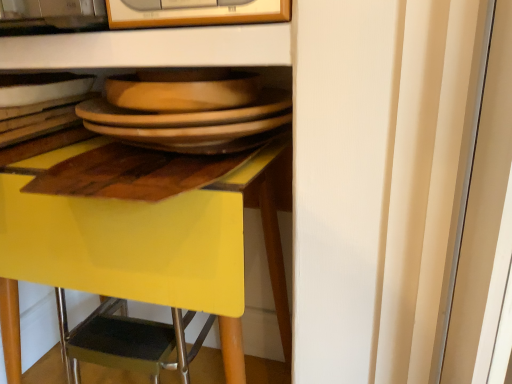
Image resolution: width=512 pixels, height=384 pixels. What do you see at coordinates (183, 89) in the screenshot?
I see `matte wooden platter at center` at bounding box center [183, 89].

Measure the distance between point (138, 4) and camera.

They are 65.60 centimeters apart.

Describe the element at coordinates (152, 240) in the screenshot. I see `yellow glossy desk at center` at that location.

The width and height of the screenshot is (512, 384). What do you see at coordinates (191, 132) in the screenshot? I see `brown matte plate at center` at bounding box center [191, 132].

This screenshot has width=512, height=384. What are the coordinates of `matte wooden platter at center` in the screenshot? It's located at (183, 89).

Does yellow glossy desk at center have a lesser width compared to matte white bowl at upper left?

No.

In the scene shown: Is yellow glossy desk at center shorter than matte white bowl at upper left?

Incorrect, the height of yellow glossy desk at center does not fall short of that of matte white bowl at upper left.

From the image's perspective, which is below, yellow glossy desk at center or matte white bowl at upper left?

yellow glossy desk at center.

Which object is wider, wooden frame at upper center or brown matte plate at center?

With larger width is brown matte plate at center.

Can you tell me how much wooden frame at upper center and brown matte plate at center differ in facing direction?

The facing directions of wooden frame at upper center and brown matte plate at center are 6.03 degrees apart.

This screenshot has width=512, height=384. Identify the location of plate below the wooden frame at upper center (from a real-world perspective). (191, 132).

Is wooden frame at upper center far away from brown matte plate at center?

wooden frame at upper center is actually quite close to brown matte plate at center.

Would you say matte wooden platter at center is a long distance from wooden frame at upper center?

No, there isn't a large distance between matte wooden platter at center and wooden frame at upper center.

From the image's perspective, which is below, matte wooden platter at center or wooden frame at upper center?

matte wooden platter at center, from the image's perspective.

Is matte wooden platter at center surrounding wooden frame at upper center?

Definitely not — wooden frame at upper center is not inside matte wooden platter at center.

How many degrees apart are the facing directions of matte wooden platter at center and wooden frame at upper center?

matte wooden platter at center and wooden frame at upper center are facing 6.03 degrees away from each other.

How different are the orientations of brown matte plate at center and yellow glossy desk at center in degrees?

3.7 degrees.

Measure the distance from brown matte plate at center to yellow glossy desk at center.

brown matte plate at center is 8.26 inches from yellow glossy desk at center.

Consider the image. Which is behind, brown matte plate at center or yellow glossy desk at center?

brown matte plate at center is further away from the camera.

Between brown matte plate at center and yellow glossy desk at center, which one has more height?

With more height is yellow glossy desk at center.

Can you tell me how much matte white bowl at upper left and yellow glossy desk at center differ in facing direction?

The facing directions of matte white bowl at upper left and yellow glossy desk at center are 5.67 degrees apart.

Considering the sizes of objects matte white bowl at upper left and yellow glossy desk at center in the image provided, who is shorter, matte white bowl at upper left or yellow glossy desk at center?

With less height is matte white bowl at upper left.

From the image's perspective, would you say matte white bowl at upper left is shown under yellow glossy desk at center?

No, from the image's perspective, matte white bowl at upper left is not below yellow glossy desk at center.

From a real-world perspective, is matte white bowl at upper left positioned above or below yellow glossy desk at center?

Clearly, from a real-world perspective, matte white bowl at upper left is above yellow glossy desk at center.

Looking at this image, how different are the orientations of yellow glossy desk at center and wooden frame at upper center in degrees?

2.33 degrees separate the facing orientations of yellow glossy desk at center and wooden frame at upper center.

From the image's perspective, which is below, yellow glossy desk at center or wooden frame at upper center?

yellow glossy desk at center is shown below in the image.

Which point is more distant from viewer, [63,276] or [234,12]?

The point [63,276] is farther from the camera.

Measure the distance between yellow glossy desk at center and wooden frame at upper center.

yellow glossy desk at center and wooden frame at upper center are 16.84 inches apart from each other.

From the image's perspective, is wooden frame at upper center positioned above or below matte white bowl at upper left?

Clearly, from the image's perspective, wooden frame at upper center is above matte white bowl at upper left.

What's the angular difference between wooden frame at upper center and matte white bowl at upper left's facing directions?

3.33 degrees separate the facing orientations of wooden frame at upper center and matte white bowl at upper left.

In the image, is wooden frame at upper center positioned in front of or behind matte white bowl at upper left?

Visually, wooden frame at upper center is located in front of matte white bowl at upper left.

Is point (212, 6) closer or farther from the camera than point (46, 89)?

Point (212, 6) is positioned closer to the camera compared to point (46, 89).

Find the location of `tableware above the yellow glossy desk at center (from the image's perspective)`. tableware above the yellow glossy desk at center (from the image's perspective) is located at coordinates (41, 87).

Locate an element on the screen. appliance on the right of brown matte plate at center is located at coordinates (194, 12).

Based on their spatial positions, is yellow glossy desk at center or brown matte plate at center closer to wooden frame at upper center?

Among the two, brown matte plate at center is located nearer to wooden frame at upper center.

Considering their positions, is wooden frame at upper center positioned closer to yellow glossy desk at center than matte white bowl at upper left?

Based on the image, matte white bowl at upper left appears to be nearer to yellow glossy desk at center.

Considering their positions, is wooden frame at upper center positioned further to matte wooden platter at center than matte white bowl at upper left?

The object further to matte wooden platter at center is matte white bowl at upper left.

Estimate the real-world distances between objects in this image. Which object is further from brown matte plate at center, matte white bowl at upper left or wooden frame at upper center?

matte white bowl at upper left is further to brown matte plate at center.

From the image, which object appears to be farther from wooden frame at upper center, brown matte plate at center or yellow glossy desk at center?

yellow glossy desk at center is positioned further to the anchor wooden frame at upper center.

Which object lies nearer to the anchor point brown matte plate at center, matte white bowl at upper left or yellow glossy desk at center?

Based on the image, yellow glossy desk at center appears to be nearer to brown matte plate at center.

Based on their spatial positions, is brown matte plate at center or wooden frame at upper center closer to matte white bowl at upper left?

brown matte plate at center lies closer to matte white bowl at upper left than the other object.

Based on their spatial positions, is matte wooden platter at center or brown matte plate at center closer to wooden frame at upper center?

Based on the image, matte wooden platter at center appears to be nearer to wooden frame at upper center.

This screenshot has width=512, height=384. I want to click on plate between wooden frame at upper center and yellow glossy desk at center in the up-down direction, so click(x=191, y=132).

The height and width of the screenshot is (384, 512). I want to click on platter between matte white bowl at upper left and yellow glossy desk at center from top to bottom, so click(183, 89).

At what (x,y) coordinates should I click in order to perform the action: click on tableware between wooden frame at upper center and yellow glossy desk at center in the up-down direction. Please return your answer as a coordinate pair (x, y). Looking at the image, I should click on (41, 87).

Image resolution: width=512 pixels, height=384 pixels. What are the coordinates of `plate between matte white bowl at upper left and wooden frame at upper center in the horizontal direction` in the screenshot? It's located at (191, 132).